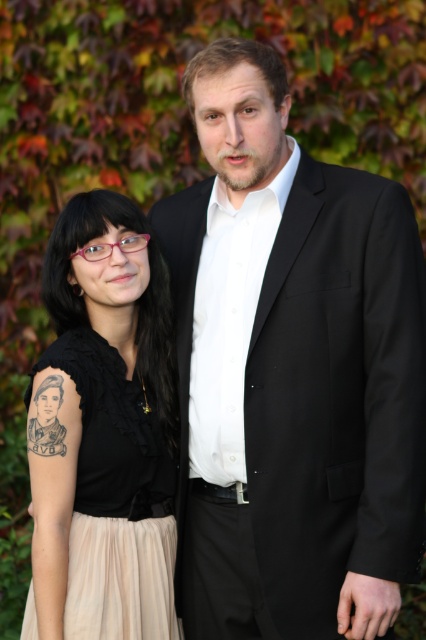
You are a photographer setting up for a portrait shoot. You notice two black items in the frame. The black smooth suit at center and the black matte tattoo at left. Which one is closer to the right edge of the photo?

The black smooth suit at center is positioned on the right side of the black matte tattoo at left, so it is closer to the right edge of the photo.

You are standing at the origin point in the image. Which of the two points, point (184, 216) or point (43, 516), is farther away from you?

Point (184, 216) is behind point (43, 516), so it is farther away from you.

You are a photographer setting up a tripod to capture the scene described. The tripod has a limited range and can only focus on objects within a 0.3 unit radius around the center point. Given the coordinates provided for the black smooth suit at center, will the tripod be able to focus on it?

The black smooth suit at center is positioned at coordinates point (x=290, y=372). Since the tripod can focus within a 0.3 unit radius around the center point, the distance from the center to the black smooth suit at center is sqrt 0.583 squared plus 0.683 squared. Calculating that gives sqrt 0.340 plus 0.466 equals sqrt 0.806, which is approximately 0.898 units. This exceeds the 0.3 unit radius, so the tripod cannot focus on the black smooth suit at center.